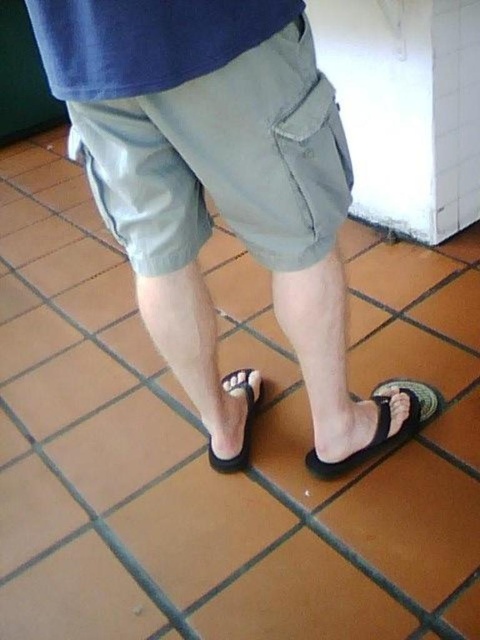
Question: Among these objects, which one is farthest from the camera?

Choices:
 (A) black rubber sandal at lower right
 (B) matte khaki shorts at center
 (C) black rubber flip-flop at center

Answer: (C)

Question: Considering the real-world distances, which object is farthest from the matte khaki shorts at center?

Choices:
 (A) black rubber flip-flop at center
 (B) black rubber sandal at lower right

Answer: (A)

Question: Is matte khaki shorts at center below black rubber sandal at lower right?

Choices:
 (A) no
 (B) yes

Answer: (A)

Question: Is black rubber sandal at lower right in front of black rubber flip-flop at center?

Choices:
 (A) no
 (B) yes

Answer: (B)

Question: Which point is farther to the camera?

Choices:
 (A) (264, 262)
 (B) (381, 422)
 (C) (247, 454)

Answer: (C)

Question: Does black rubber sandal at lower right appear over black rubber flip-flop at center?

Choices:
 (A) no
 (B) yes

Answer: (A)